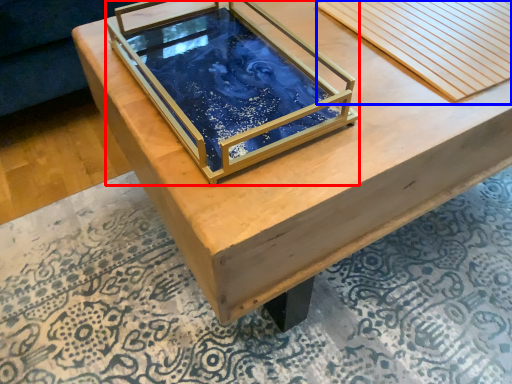
Question: Which object is closer to the camera taking this photo, glass box (highlighted by a red box) or plank (highlighted by a blue box)?

Choices:
 (A) glass box
 (B) plank

Answer: (A)